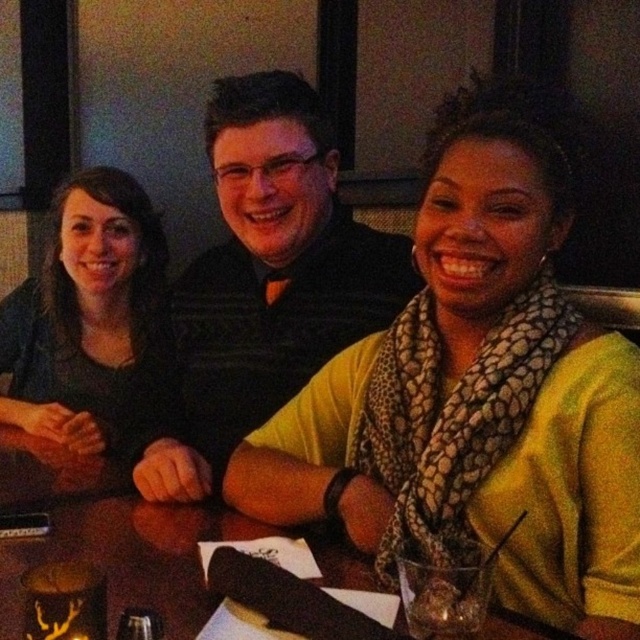
You are a photographer setting up a tripod to take a group photo of the matte black shirt at left and the wooden table at center. The tripod can only accommodate objects up to 1.2 meters in height. Will both objects fit within the tripod height limit?

The matte black shirt at left is taller than the wooden table at center. Since the tripod can only accommodate up to 1.2 meters, both objects will fit as long as the tallest object, the matte black shirt at left, is within the limit. However, without specific height measurements, we cannot confirm if it exceeds 1.2 meters. Please ensure the matte black shirt at left does not surpass the tripod height limit.

You are a photographer setting up a camera to take a group photo of the matte black shirt at left and the wooden table at center. Based on their sizes, which object should you focus on first to ensure proper framing?

The matte black shirt at left is bigger than the wooden table at center, so you should focus on the matte black shirt at left first to ensure proper framing.

You are a photographer standing in front of the scene. You want to take a photo of the yellow matte scarf at center and the wooden table at center. According to the scene description, which object is positioned further back from your viewpoint?

The wooden table at center is positioned further back from your viewpoint because it is described as being behind the yellow matte scarf at center.